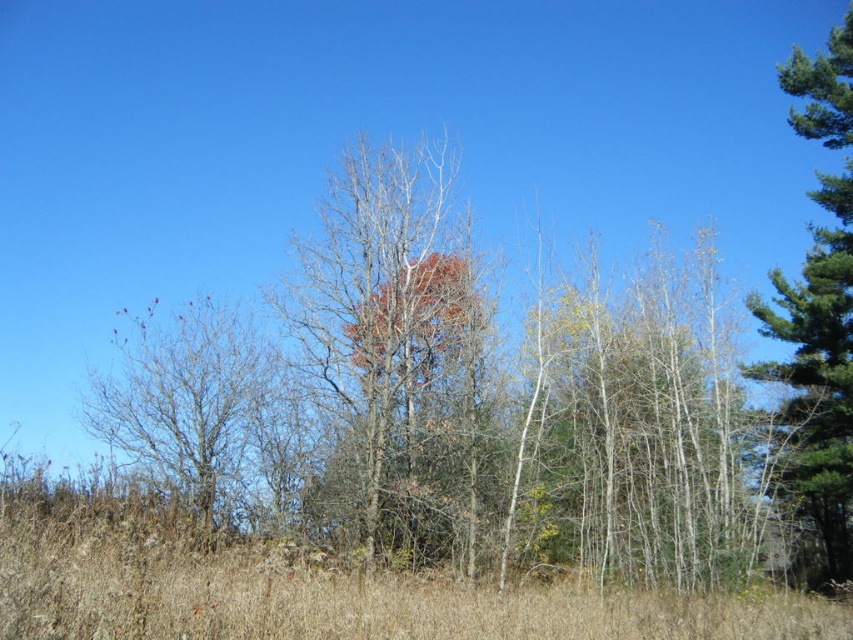
Which of these two, brown dry grass at lower center or reddish-brown bark tree at center, stands taller?

Standing taller between the two is reddish-brown bark tree at center.

Describe the element at coordinates (328, 593) in the screenshot. I see `brown dry grass at lower center` at that location.

This screenshot has height=640, width=853. What do you see at coordinates (328, 593) in the screenshot?
I see `brown dry grass at lower center` at bounding box center [328, 593].

Locate an element on the screen. This screenshot has width=853, height=640. brown dry grass at lower center is located at coordinates (328, 593).

Is green textured pine tree at right further to the viewer compared to bare branches at left?

Yes.

Who is shorter, green textured pine tree at right or bare branches at left?

Standing shorter between the two is bare branches at left.

Which is behind, point (827, 458) or point (164, 440)?

The point (827, 458) is more distant.

This screenshot has width=853, height=640. Find the location of `green textured pine tree at right`. green textured pine tree at right is located at coordinates (817, 376).

Based on the photo, who is taller, brown dry grass at lower center or green textured pine tree at right?

green textured pine tree at right

Locate an element on the screen. brown dry grass at lower center is located at coordinates (328, 593).